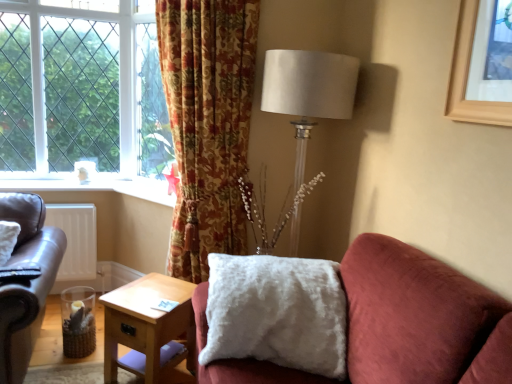
Question: Does satin white lampshade at upper right have a smaller size compared to white matte radiator at lower left?

Choices:
 (A) no
 (B) yes

Answer: (A)

Question: From the image's perspective, is satin white lampshade at upper right below white matte radiator at lower left?

Choices:
 (A) no
 (B) yes

Answer: (A)

Question: From the image's perspective, is satin white lampshade at upper right on top of white matte radiator at lower left?

Choices:
 (A) yes
 (B) no

Answer: (A)

Question: From a real-world perspective, is satin white lampshade at upper right located beneath white matte radiator at lower left?

Choices:
 (A) no
 (B) yes

Answer: (A)

Question: From a real-world perspective, is satin white lampshade at upper right over white matte radiator at lower left?

Choices:
 (A) no
 (B) yes

Answer: (B)

Question: In the image, is floral-patterned fabric curtain at upper center positioned in front of or behind satin white lampshade at upper right?

Choices:
 (A) front
 (B) behind

Answer: (A)

Question: Is floral-patterned fabric curtain at upper center situated inside satin white lampshade at upper right or outside?

Choices:
 (A) outside
 (B) inside

Answer: (A)

Question: Based on their sizes in the image, would you say floral-patterned fabric curtain at upper center is bigger or smaller than satin white lampshade at upper right?

Choices:
 (A) big
 (B) small

Answer: (A)

Question: Is point (207, 122) closer or farther from the camera than point (295, 109)?

Choices:
 (A) closer
 (B) farther

Answer: (B)

Question: Visually, is white fluffy pillow at center positioned to the left or to the right of floral-patterned fabric curtain at upper center?

Choices:
 (A) right
 (B) left

Answer: (A)

Question: From a real-world perspective, is white fluffy pillow at center positioned above or below floral-patterned fabric curtain at upper center?

Choices:
 (A) below
 (B) above

Answer: (A)

Question: Considering the positions of white fluffy pillow at center and floral-patterned fabric curtain at upper center in the image, is white fluffy pillow at center wider or thinner than floral-patterned fabric curtain at upper center?

Choices:
 (A) thin
 (B) wide

Answer: (A)

Question: Is white fluffy pillow at center bigger or smaller than floral-patterned fabric curtain at upper center?

Choices:
 (A) big
 (B) small

Answer: (B)

Question: Does point (163, 332) appear closer or farther from the camera than point (12, 66)?

Choices:
 (A) farther
 (B) closer

Answer: (B)

Question: Looking at their shapes, would you say light wood/texture side table at lower center is wider or thinner than green leafy tree at left?

Choices:
 (A) wide
 (B) thin

Answer: (A)